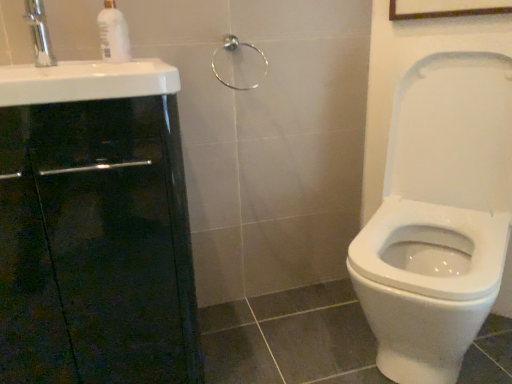
Question: Based on their sizes in the image, would you say white glossy sink at left is bigger or smaller than silver metallic faucet at upper left?

Choices:
 (A) big
 (B) small

Answer: (A)

Question: Looking at their shapes, would you say white glossy sink at left is wider or thinner than silver metallic faucet at upper left?

Choices:
 (A) wide
 (B) thin

Answer: (A)

Question: Based on their relative distances, which object is nearer to the silver metallic faucet at upper left?

Choices:
 (A) white glossy sink at left
 (B) white glossy soap dispenser at upper left
 (C) black glossy cabinet at left
 (D) satin nickel towel ring at upper center

Answer: (B)

Question: Which object is positioned closest to the black glossy cabinet at left?

Choices:
 (A) white glossy soap dispenser at upper left
 (B) white glossy sink at left
 (C) silver metallic faucet at upper left
 (D) satin nickel towel ring at upper center

Answer: (B)